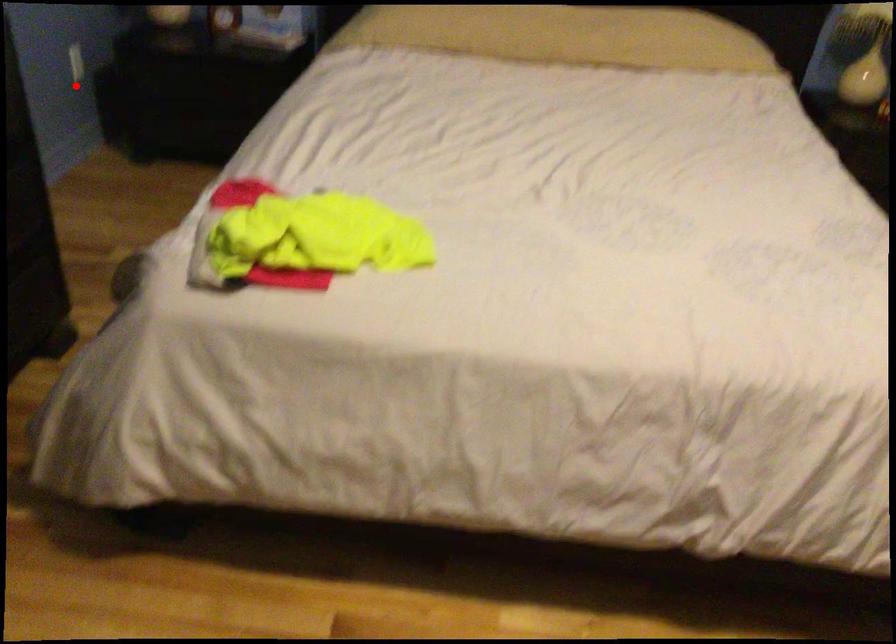
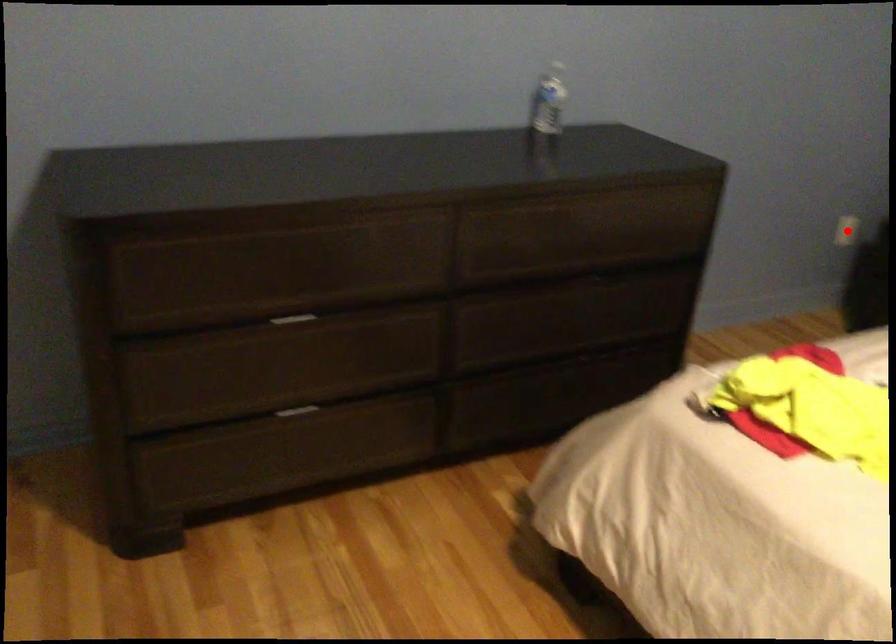
I am providing you with two images of the same scene from different viewpoints. A red point is marked on the first image and another point is marked on the second image. Does the point marked in image1 correspond to the same location as the one in image2?

Yes